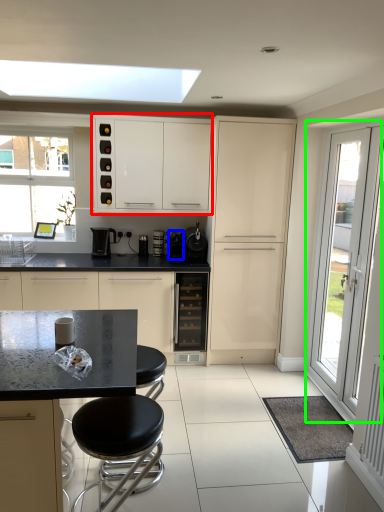
Question: Based on their relative distances, which object is farther from cabinetry (highlighted by a red box)? Choose from coffee machine (highlighted by a blue box) and door (highlighted by a green box).

Choices:
 (A) coffee machine
 (B) door

Answer: (B)